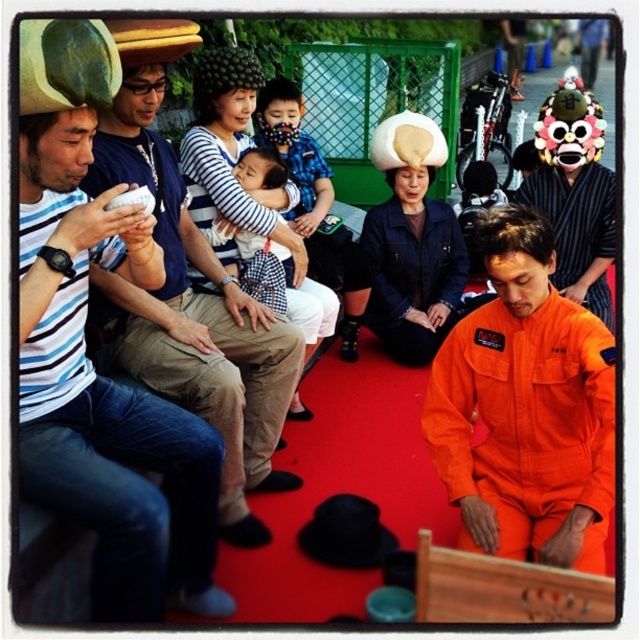
Looking at the scene described, which object is positioned to the left of the other between the matte striped shirt at left and the matte black phone at left?

The matte striped shirt at left is positioned to the left of the matte black phone at left.

You are at an event and need to place both the matte black phone at left and the checkered fabric shirt at center into a small bag. Which item will require more space?

The matte black phone at left is larger in size than the checkered fabric shirt at center, so it will require more space in the bag.